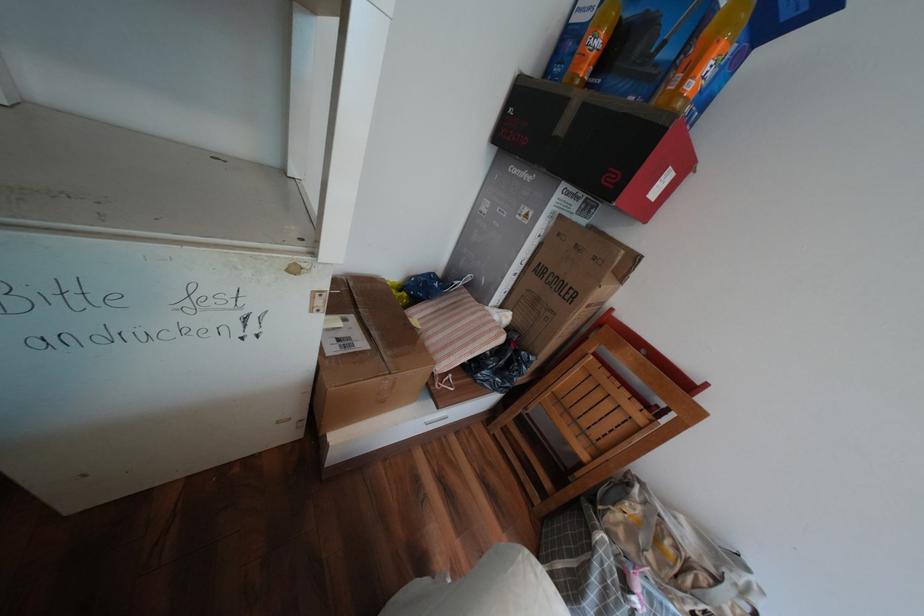
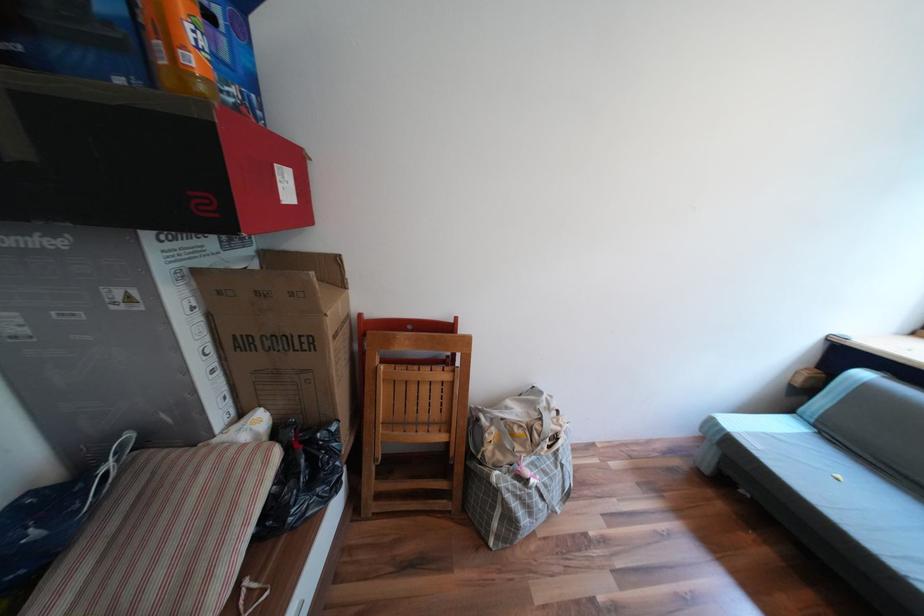
Locate, in the second image, the point that corresponds to (500,330) in the first image.

(258, 464)